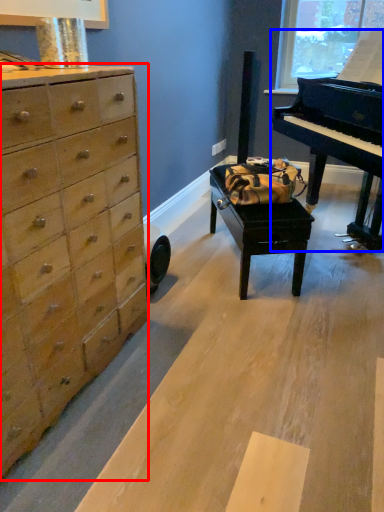
Question: Which object is closer to the camera taking this photo, chest of drawers (highlighted by a red box) or piano (highlighted by a blue box)?

Choices:
 (A) chest of drawers
 (B) piano

Answer: (A)